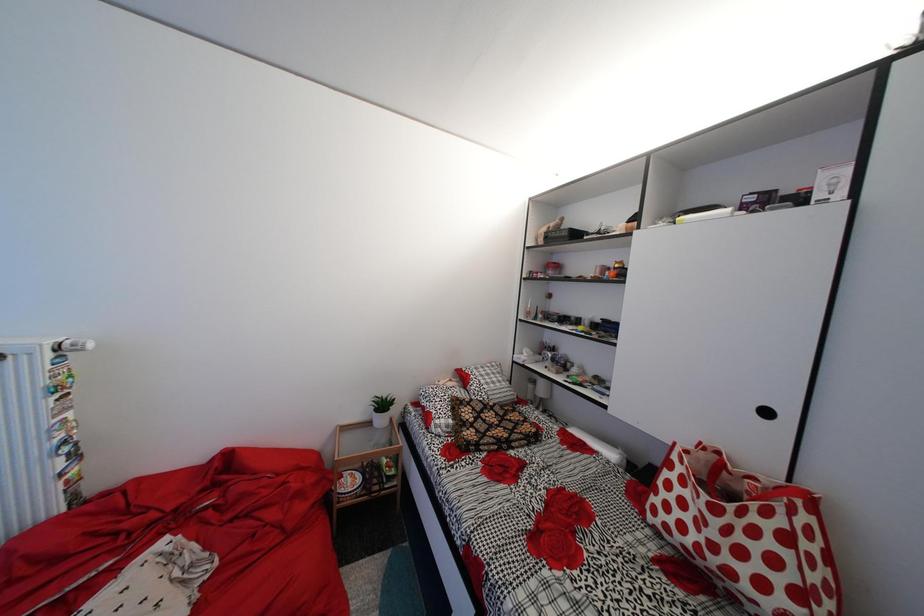
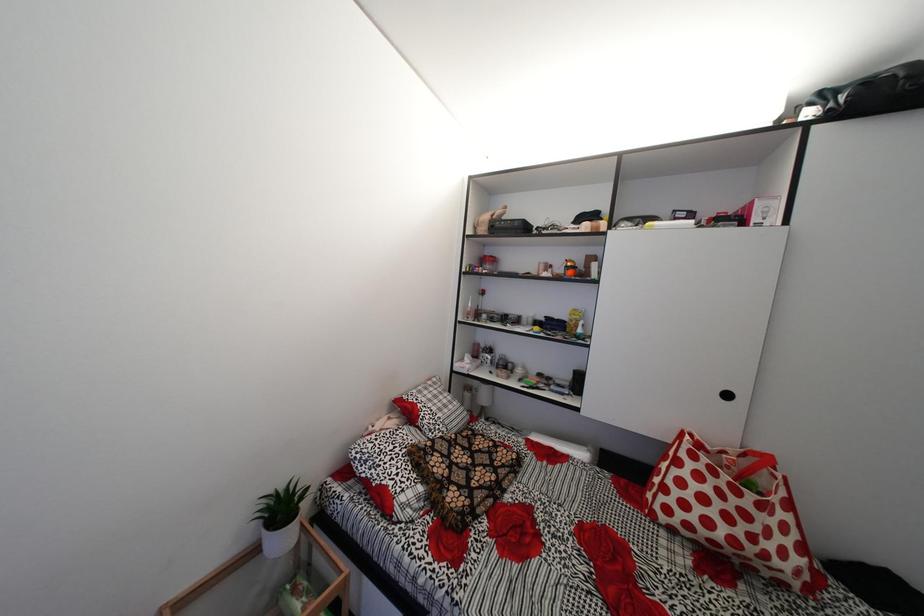
Question: How did the camera likely rotate?

Choices:
 (A) Left
 (B) Right
 (C) Up
 (D) Down

Answer: (B)